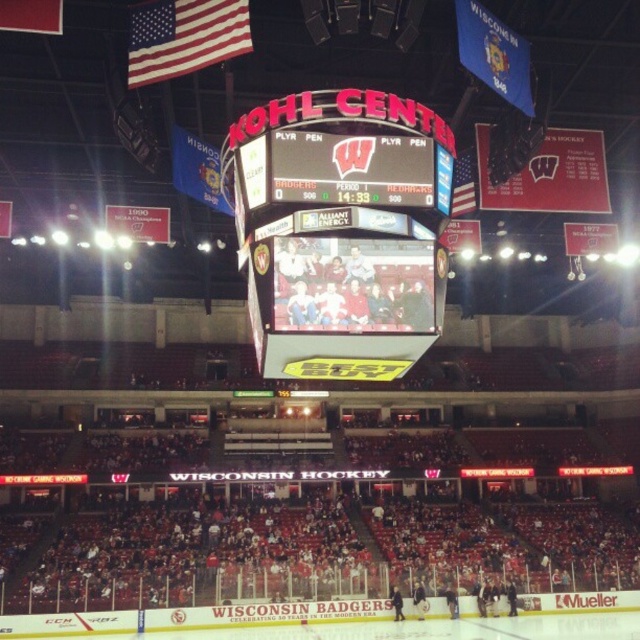
Question: Considering the relative positions of matte digital display at center and american flag at upper left in the image provided, where is matte digital display at center located with respect to american flag at upper left?

Choices:
 (A) right
 (B) left

Answer: (A)

Question: Can you confirm if matte digital display at center is positioned below american flag at upper left?

Choices:
 (A) yes
 (B) no

Answer: (A)

Question: Is matte digital display at center below american flag at upper left?

Choices:
 (A) yes
 (B) no

Answer: (A)

Question: Which object appears farthest from the camera in this image?

Choices:
 (A) american flag at upper left
 (B) matte digital display at center

Answer: (A)